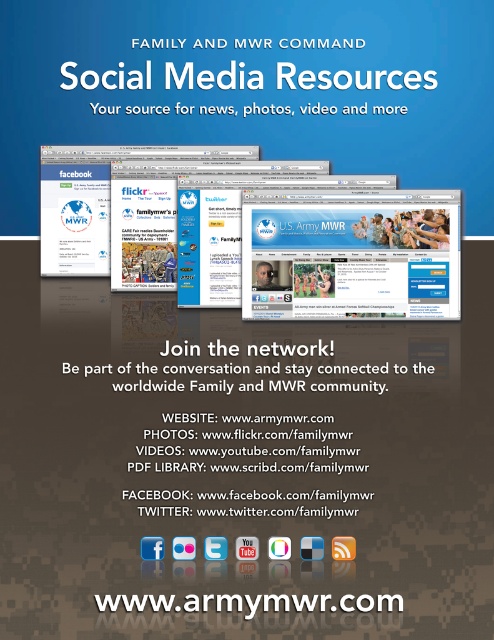
You are designing a poster and need to ensure that the white paper at center and the white text on brown website at bottom are visible. Based on their sizes, which object should you place higher up to maintain visibility?

The white paper at center has a greater height, so placing it higher up will ensure both objects remain visible while accommodating their size differences.

You are looking at the advertisement and notice two points marked on it. The first point is at position (302, 300) and the second is at (107, 600). Which point appears closer to you?

Point (302, 300) is further to the viewer than point (107, 600), so the first point is closer to you.

You are designing a poster and need to place the blue glossy computer screen at center and the white text on brown website at bottom. Which object should you make wider to ensure both fit without overlapping?

The blue glossy computer screen at center has a smaller width than the white text on brown website at bottom, so you should make the blue glossy computer screen at center wider to accommodate both without overlapping.